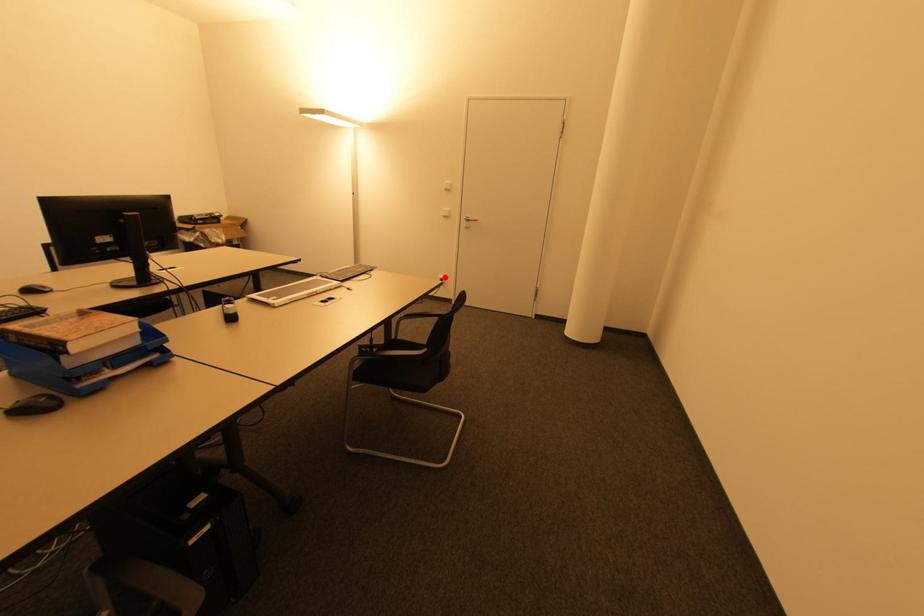
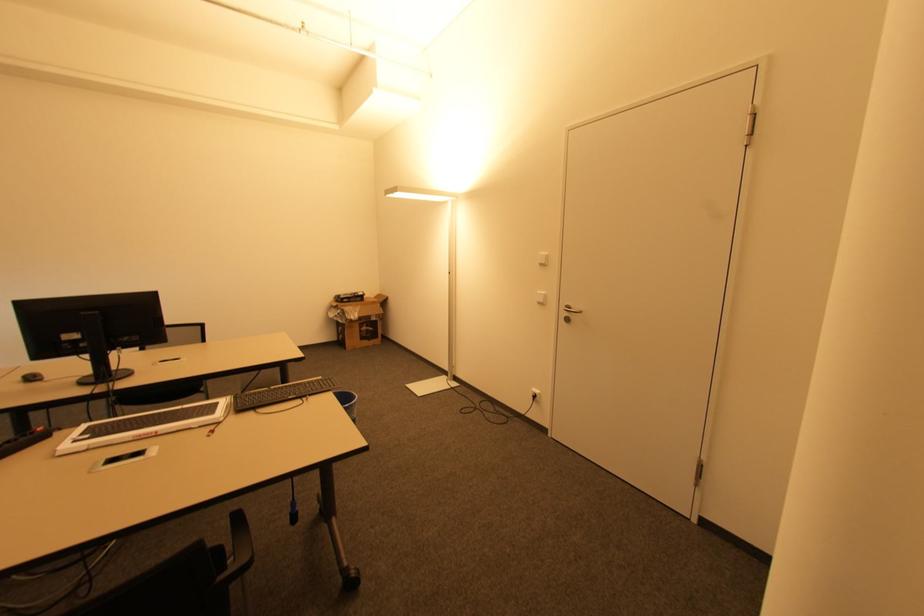
The point at the highlighted location is marked in the first image. Where is the corresponding point in the second image?

(539, 392)